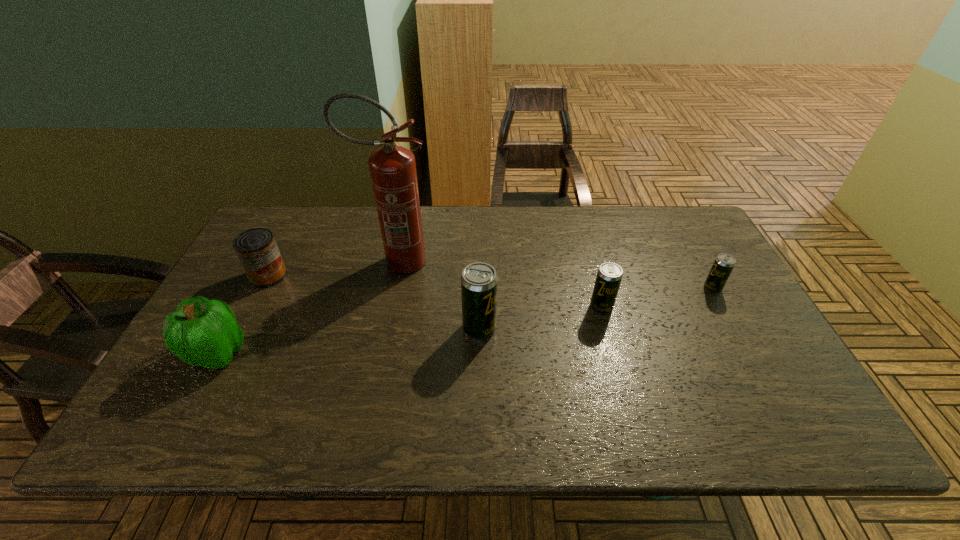
Locate an element on the screen. The height and width of the screenshot is (540, 960). object at the right edge is located at coordinates (723, 265).

Identify the location of object at the near left corner. This screenshot has width=960, height=540. (202, 332).

I want to click on vacant area at the far edge of the desktop, so click(x=469, y=210).

In the image, there is a desktop. Where is `vacant area at the near edge`? The image size is (960, 540). vacant area at the near edge is located at coordinates (280, 386).

In the image, there is a desktop. Where is `vacant space at the right edge`? This screenshot has height=540, width=960. vacant space at the right edge is located at coordinates (712, 300).

Locate an element on the screen. The width and height of the screenshot is (960, 540). vacant space at the far left corner of the desktop is located at coordinates (264, 221).

In the image, there is a desktop. Where is `blank space at the far right corner`? This screenshot has width=960, height=540. blank space at the far right corner is located at coordinates (667, 221).

You are a GUI agent. You are given a task and a screenshot of the screen. Output one action in this format:
    pyautogui.click(x=<x>, y=<y>)
    Task: Click on the vacant space that is in between the second shortest beer can and the rightmost beer can
    The image size is (960, 540).
    Given the screenshot: What is the action you would take?
    pyautogui.click(x=657, y=298)

Locate an element on the screen. free space between the third object from left to right and the bell pepper is located at coordinates (306, 308).

Where is `empty space between the third object from left to right and the bell pepper`? The width and height of the screenshot is (960, 540). empty space between the third object from left to right and the bell pepper is located at coordinates (306, 308).